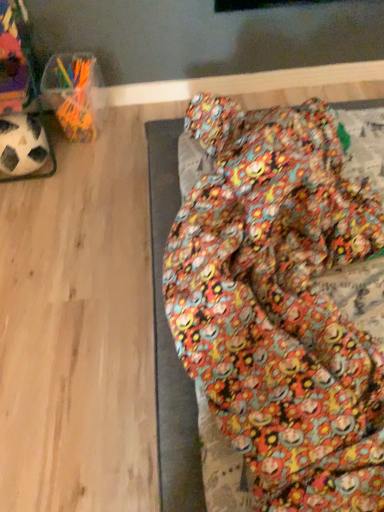
The height and width of the screenshot is (512, 384). I want to click on vacant space in front of black matte soccer ball at left, so click(x=35, y=204).